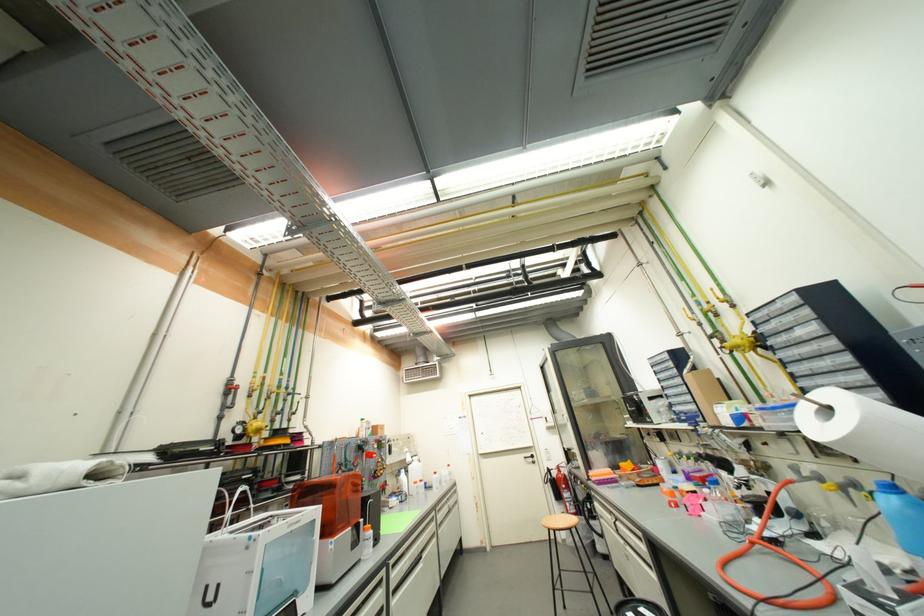
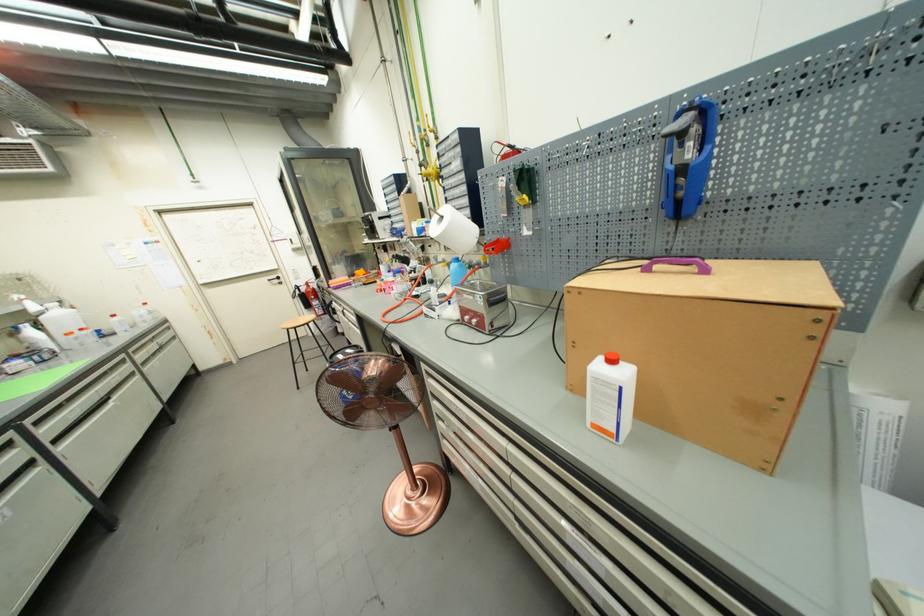
Find the pixel in the second image that matches the point at 560,416 in the first image.

(306, 237)